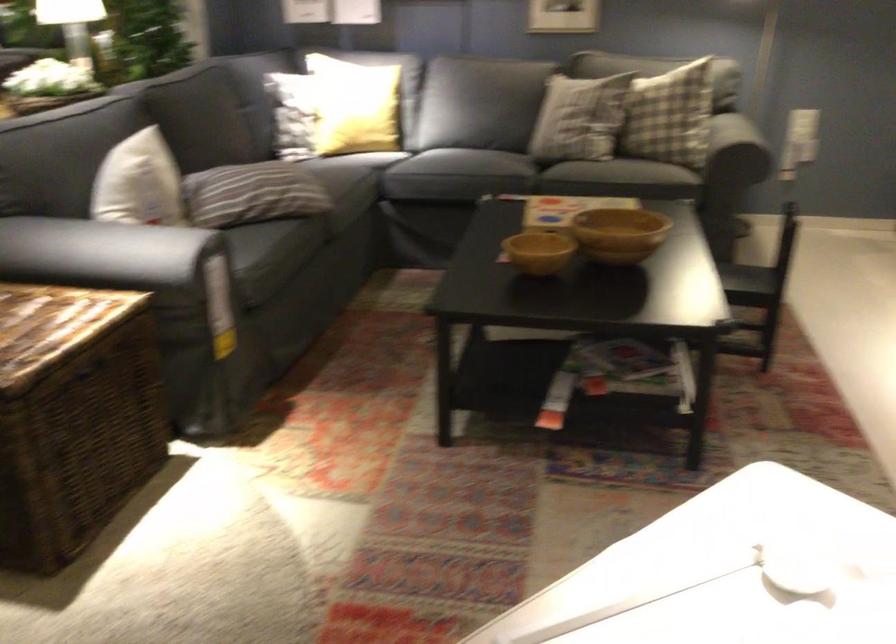
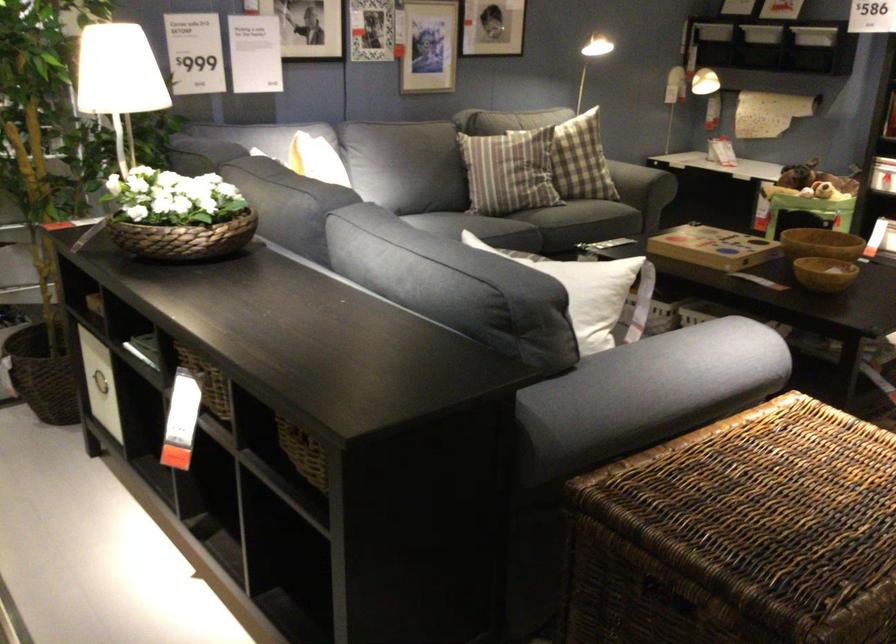
Find the pixel in the second image that matches (124,174) in the first image.

(581, 272)